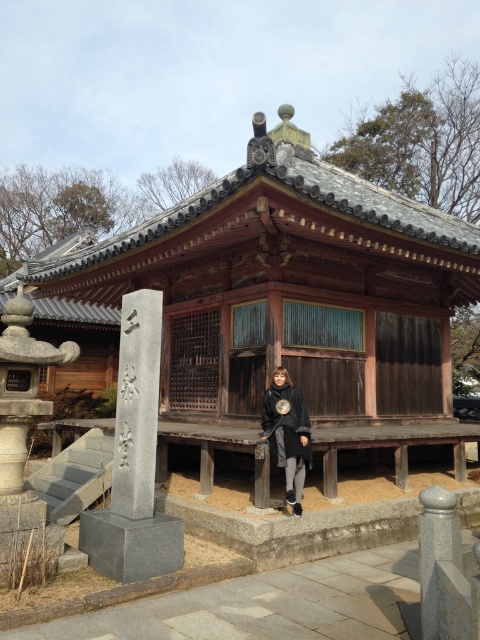
You are a visitor at the temple and want to take a photo of both gray stone pillars. You are standing in front of the building. Which direction should you face to ensure both gray stone pillar at left and gray stone pillar at lower right are in your frame?

You should face towards the center of the temple area so that both gray stone pillar at left and gray stone pillar at lower right are visible in your view. Since the gray stone pillar at left is to the left of gray stone pillar at lower right, positioning yourself centrally will allow you to capture both pillars in the frame.